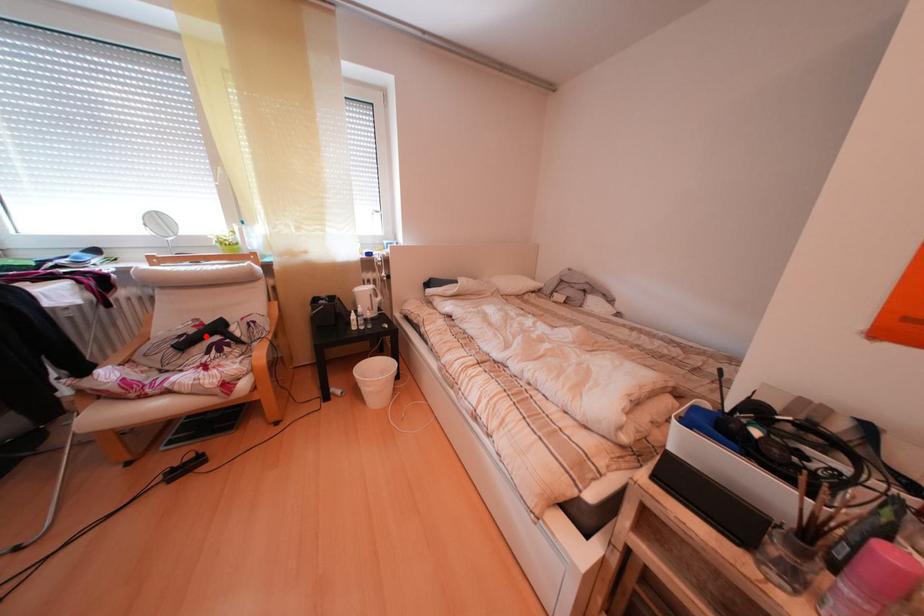
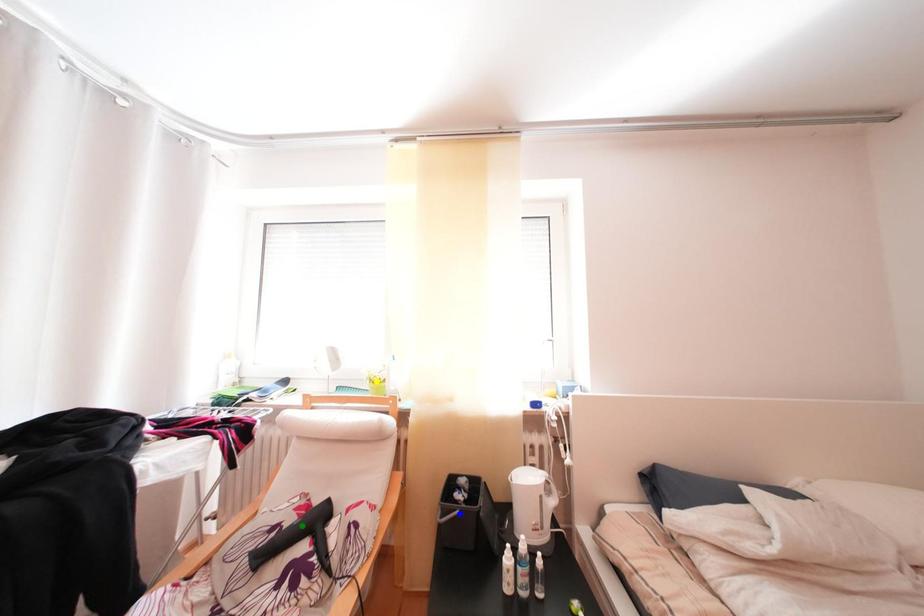
Question: I am providing you with two images of the same scene from different viewpoints. A red point is marked on the first image. You are given multiple points on the second image. Which mark in image 2 goes with the point in image 1?

Choices:
 (A) yellow point
 (B) blue point
 (C) green point

Answer: (C)